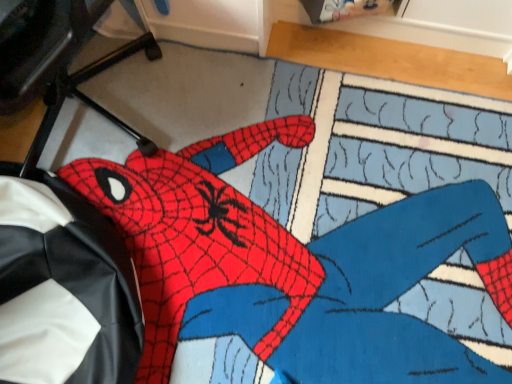
Question: Is black leather bean bag chair at left positioned beyond the bounds of red matte spider-man figure at center?

Choices:
 (A) no
 (B) yes

Answer: (B)

Question: Is black leather bean bag chair at left smaller than red matte spider-man figure at center?

Choices:
 (A) yes
 (B) no

Answer: (B)

Question: Does black leather bean bag chair at left have a greater width compared to red matte spider-man figure at center?

Choices:
 (A) no
 (B) yes

Answer: (A)

Question: Could you tell me if black leather bean bag chair at left is turned towards red matte spider-man figure at center?

Choices:
 (A) yes
 (B) no

Answer: (A)

Question: Is black leather bean bag chair at left bigger than red matte spider-man figure at center?

Choices:
 (A) no
 (B) yes

Answer: (B)

Question: Is black leather bean bag chair at left positioned in front of red matte spider-man figure at center?

Choices:
 (A) yes
 (B) no

Answer: (A)

Question: Does black leather bean bag chair at left have a larger size compared to black leather computer chair at lower left?

Choices:
 (A) yes
 (B) no

Answer: (B)

Question: Does black leather bean bag chair at left appear on the left side of black leather computer chair at lower left?

Choices:
 (A) no
 (B) yes

Answer: (A)

Question: From a real-world perspective, is black leather bean bag chair at left positioned under black leather computer chair at lower left based on gravity?

Choices:
 (A) yes
 (B) no

Answer: (A)

Question: Does black leather bean bag chair at left have a greater width compared to black leather computer chair at lower left?

Choices:
 (A) no
 (B) yes

Answer: (A)

Question: Does black leather bean bag chair at left come behind black leather computer chair at lower left?

Choices:
 (A) no
 (B) yes

Answer: (B)

Question: From the image's perspective, is black leather bean bag chair at left on top of black leather computer chair at lower left?

Choices:
 (A) yes
 (B) no

Answer: (B)

Question: Would you say black leather bean bag chair at left is part of black leather computer chair at lower left's contents?

Choices:
 (A) no
 (B) yes

Answer: (A)